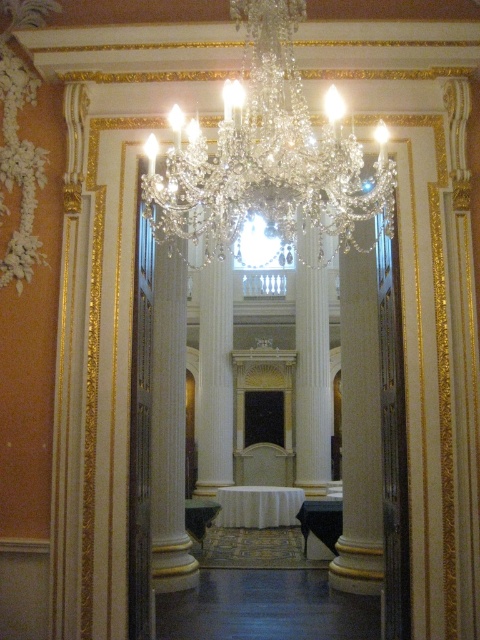
You are standing in the room and want to touch the crystal clear chandelier at center and the white marble pillar at center. Which object will you reach first?

The crystal clear chandelier at center is closer to the viewer than the white marble pillar at center, so you will reach the crystal clear chandelier at center first.

You are an interior designer planning to hang a new artwork on the wall. The crystal clear chandelier at center is located at point (265, 154). Where should you place the artwork so it doesn not interfere with the chandelier?

The crystal clear chandelier at center is located at point (265, 154), so you should place the artwork away from that coordinate to avoid interference.

You are an interior designer planning to install a new lighting fixture in this room. You have a design that requires the space above the white marble pillar at center to accommodate a fixture no larger than the pillar itself. Can the crystal clear chandelier at center currently occupying that space be replaced with your design?

The crystal clear chandelier at center is larger in size than white marble pillar at center, so it cannot be replaced with the new design since the existing chandelier is bigger than the pillar, exceeding the required size constraint.